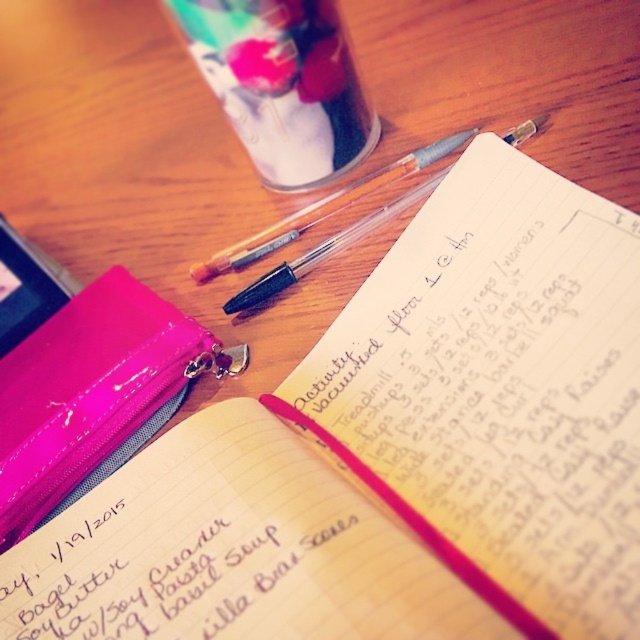
Between matte paper notebook at center and pink glossy binder at lower left, which one is positioned higher?

pink glossy binder at lower left

Does matte paper notebook at center appear on the right side of pink glossy binder at lower left?

Indeed, matte paper notebook at center is positioned on the right side of pink glossy binder at lower left.

The height and width of the screenshot is (640, 640). Identify the location of matte paper notebook at center. (180, 570).

What are the coordinates of `matte paper notebook at center` in the screenshot? It's located at (180, 570).